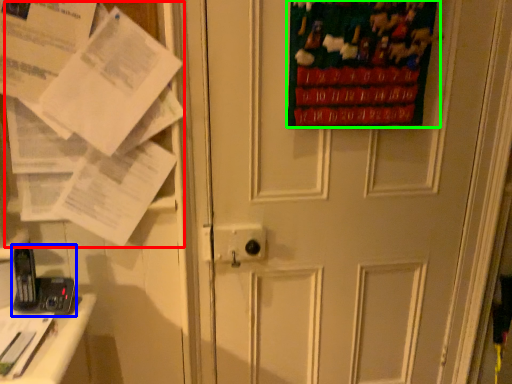
Question: Considering the real-world distances, which object is closest to paper (highlighted by a red box)? equipment (highlighted by a blue box) or poster page (highlighted by a green box).

Choices:
 (A) equipment
 (B) poster page

Answer: (A)